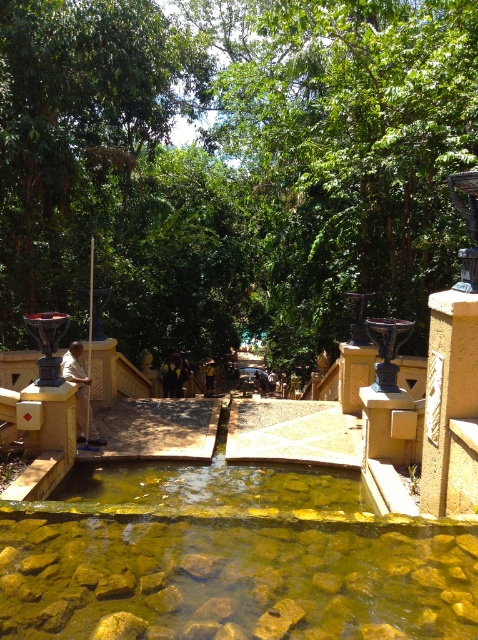
Question: Which object is farther from the camera taking this photo?

Choices:
 (A) green leafy tree at center
 (B) clear stone water at center

Answer: (A)

Question: Does green leafy tree at center come in front of clear stone water at center?

Choices:
 (A) no
 (B) yes

Answer: (A)

Question: Which object appears farthest from the camera in this image?

Choices:
 (A) clear stone water at center
 (B) green leafy tree at center

Answer: (B)

Question: Does green leafy tree at center come behind clear stone water at center?

Choices:
 (A) no
 (B) yes

Answer: (B)

Question: Can you confirm if green leafy tree at center is positioned to the right of clear stone water at center?

Choices:
 (A) yes
 (B) no

Answer: (B)

Question: Which object appears closest to the camera in this image?

Choices:
 (A) green leafy tree at center
 (B) clear stone water at center

Answer: (B)